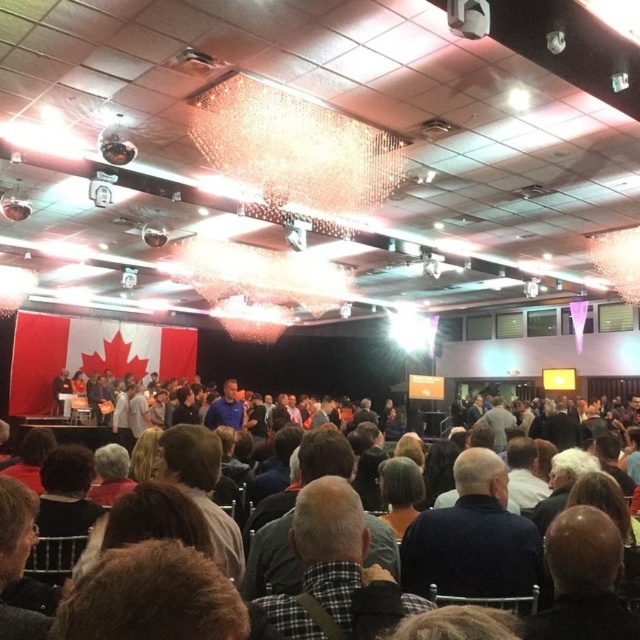
You are an event photographer at the back of the room. You need to take a photo of both the dark blue sweater at center and the bald head at center. Which one should you adjust your camera focus to first to ensure both are in the frame?

The dark blue sweater at center is positioned on the left side of bald head at center, so you should focus on the bald head at center first to ensure both are in the frame.

You are attending this event and want to take a photo of the dark blue sweater at center and the bald head at center. Which one will appear bigger in your photo?

The dark blue sweater at center will appear bigger in the photo since it is larger in size than the bald head at center.